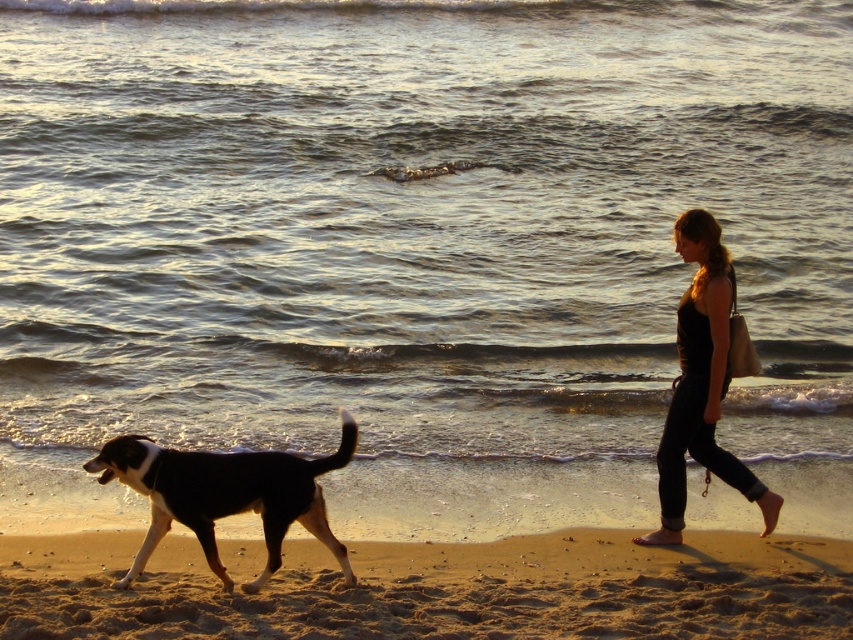
You are standing on the beach and see the black and white fur dog at lower left and the black cotton tank top at right. Which object is closer to the ocean?

The black and white fur dog at lower left is closer to the ocean because it is positioned to the left of the black cotton tank top at right, and the ocean is at the background.

You are standing at the point marked as point (438, 588) on the beach. What material are you standing on?

You are standing on sandy yellow sand at lower center.